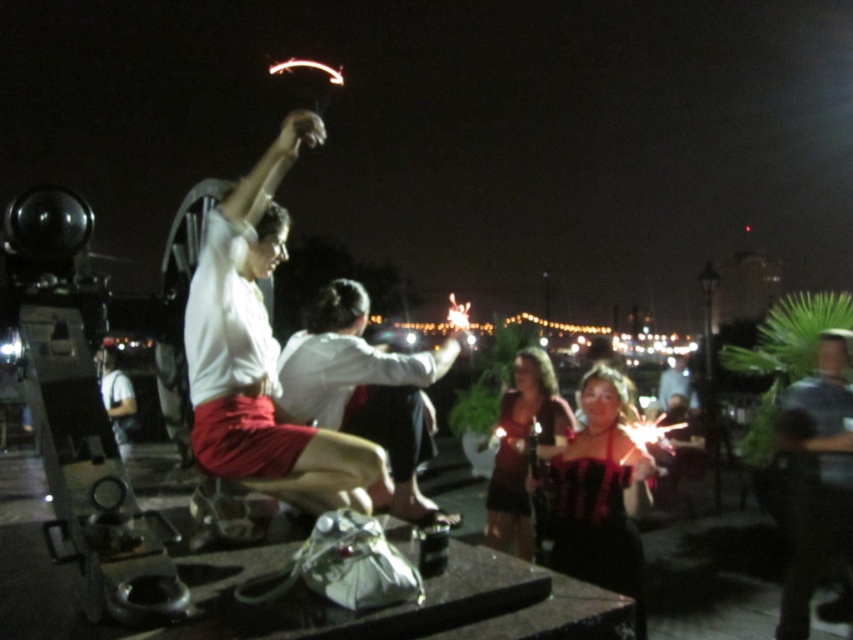
You are at a party and want to take a photo of both the white shirt at center and the matte brown dress at center. Which one should you zoom in on to ensure both fit in the frame?

You should zoom in on the matte brown dress at center because the white shirt at center might be wider than the matte brown dress at center, so zooming in on the wider object ensures both fit in the frame.